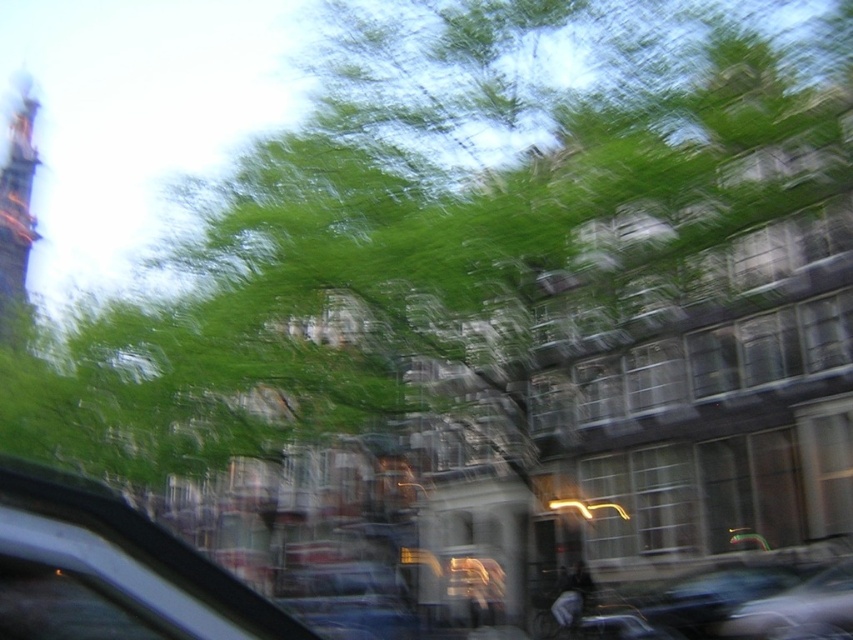
Question: Is transparent glass car window at lower left wider than dark brown wooden tower at upper left?

Choices:
 (A) yes
 (B) no

Answer: (B)

Question: Is transparent glass car window at lower left above dark brown wooden tower at upper left?

Choices:
 (A) yes
 (B) no

Answer: (B)

Question: Can you confirm if transparent glass car window at lower left is positioned above metallic silver car at lower right?

Choices:
 (A) yes
 (B) no

Answer: (A)

Question: Which object appears farthest from the camera in this image?

Choices:
 (A) dark brown wooden tower at upper left
 (B) metallic silver car at lower right
 (C) transparent glass car window at lower left

Answer: (A)

Question: Which object is positioned farthest from the dark brown wooden tower at upper left?

Choices:
 (A) metallic silver car at lower right
 (B) transparent glass car window at lower left

Answer: (A)

Question: Which object is farther from the camera taking this photo?

Choices:
 (A) transparent glass car window at lower left
 (B) dark brown wooden tower at upper left

Answer: (B)